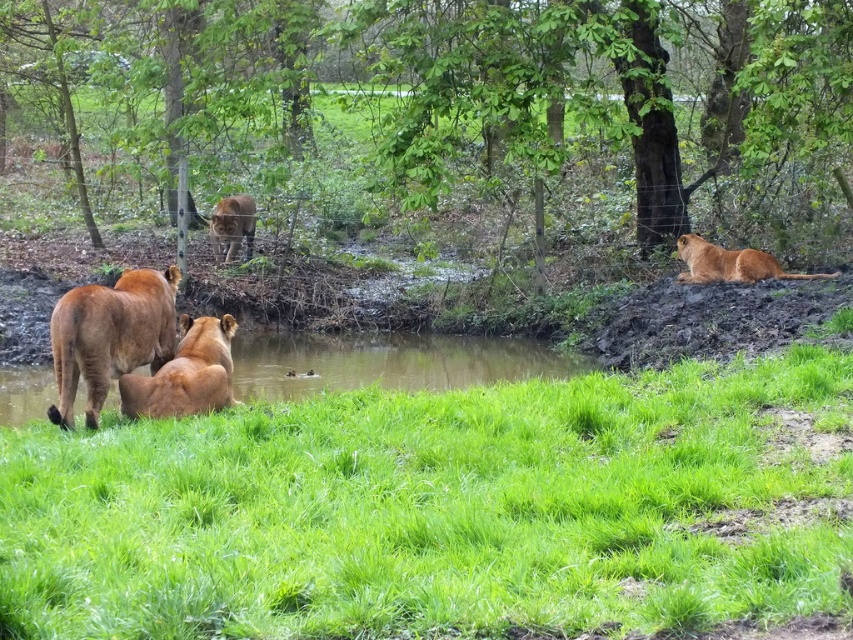
You are a wildlife photographer trying to capture a closeup of the golden fur lion at center. You are currently standing on the green grass at lower center. How can you position yourself to get the best shot without stepping into the water?

Since the green grass at lower center is bigger than the golden fur lion at center, you can move closer to the golden fur lion at center while staying on the green grass at lower center to get a better angle without entering the water.

You are a photographer planning to take a photo of the green grass at lower center and the brown furry lion at center. Based on the scene described, which object occupies a larger area in the image?

The green grass at lower center occupies a larger area in the image since its width is greater than that of the brown furry lion at center.